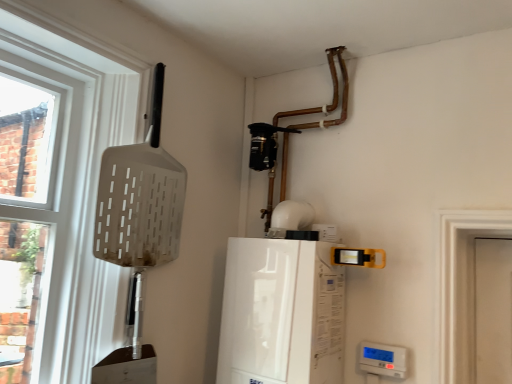
Question: Is white glossy boiler at center, the second appliance ordered from the bottom, with white plastic shovel at left?

Choices:
 (A) no
 (B) yes

Answer: (A)

Question: Considering the relative sizes of white glossy boiler at center, arranged as the second appliance when viewed from the right, and white plastic shovel at left in the image provided, is white glossy boiler at center, arranged as the second appliance when viewed from the right, shorter than white plastic shovel at left?

Choices:
 (A) no
 (B) yes

Answer: (B)

Question: Is white glossy boiler at center, arranged as the second appliance when viewed from the right, turned away from white plastic shovel at left?

Choices:
 (A) yes
 (B) no

Answer: (B)

Question: Does white glossy boiler at center, arranged as the second appliance when viewed from the right, contain white plastic shovel at left?

Choices:
 (A) yes
 (B) no

Answer: (B)

Question: Does white glossy boiler at center, arranged as the second appliance when viewed from the right, turn towards white plastic shovel at left?

Choices:
 (A) yes
 (B) no

Answer: (B)

Question: From a real-world perspective, is white glossy boiler at center, the first appliance when ordered from top to bottom, under white plastic shovel at left?

Choices:
 (A) no
 (B) yes

Answer: (B)

Question: From a real-world perspective, is white plastic thermostat at lower right, which is the 2th appliance from top to bottom, positioned over white glossy boiler at center, the first appliance when ordered from top to bottom, based on gravity?

Choices:
 (A) yes
 (B) no

Answer: (B)

Question: Is white plastic thermostat at lower right, the first appliance in the right-to-left sequence, to the left of white glossy boiler at center, the first appliance when ordered from top to bottom, from the viewer's perspective?

Choices:
 (A) yes
 (B) no

Answer: (B)

Question: Can you confirm if white plastic thermostat at lower right, the first appliance in the right-to-left sequence, is wider than white glossy boiler at center, arranged as the second appliance when viewed from the right?

Choices:
 (A) no
 (B) yes

Answer: (A)

Question: Does white plastic thermostat at lower right, which appears as the first appliance when ordered from the bottom, have a lesser height compared to white glossy boiler at center, which appears as the first appliance when viewed from the left?

Choices:
 (A) no
 (B) yes

Answer: (B)

Question: Does white plastic thermostat at lower right, which appears as the first appliance when ordered from the bottom, have a larger size compared to white glossy boiler at center, which appears as the first appliance when viewed from the left?

Choices:
 (A) yes
 (B) no

Answer: (B)

Question: From the image's perspective, is white plastic thermostat at lower right, which appears as the first appliance when ordered from the bottom, located beneath white glossy boiler at center, the second appliance ordered from the bottom?

Choices:
 (A) no
 (B) yes

Answer: (B)

Question: Can you confirm if white plastic shovel at left is taller than white glossy boiler at center, which appears as the first appliance when viewed from the left?

Choices:
 (A) no
 (B) yes

Answer: (B)